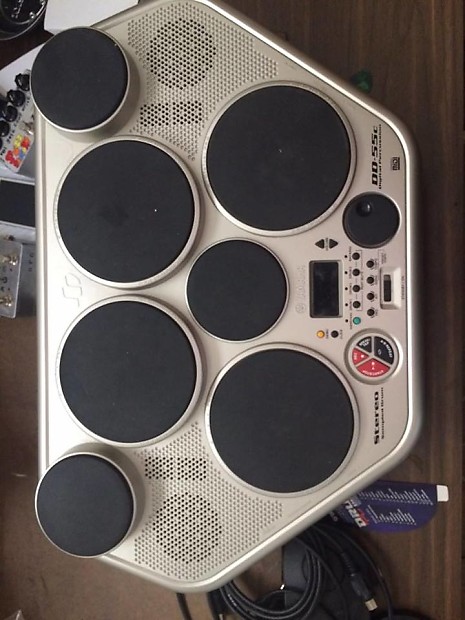
The height and width of the screenshot is (620, 465). I want to click on black cables, so click(264, 609), click(297, 611), click(341, 554).